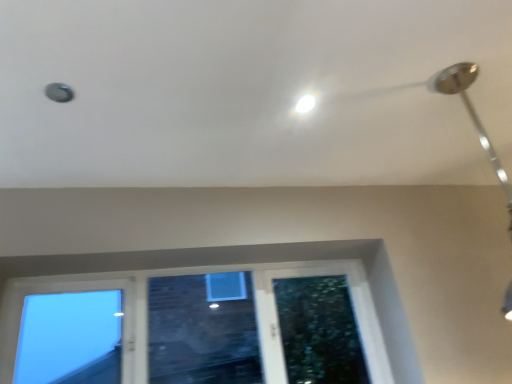
Question: Considering the relative sizes of white glossy droplight at upper center and clear glass window at lower left in the image provided, is white glossy droplight at upper center taller than clear glass window at lower left?

Choices:
 (A) yes
 (B) no

Answer: (B)

Question: Is white glossy droplight at upper center thinner than clear glass window at lower left?

Choices:
 (A) yes
 (B) no

Answer: (A)

Question: From a real-world perspective, is white glossy droplight at upper center located higher than clear glass window at lower left?

Choices:
 (A) no
 (B) yes

Answer: (B)

Question: From the image's perspective, is white glossy droplight at upper center on top of clear glass window at lower left?

Choices:
 (A) no
 (B) yes

Answer: (B)

Question: Is white glossy droplight at upper center directly adjacent to clear glass window at lower left?

Choices:
 (A) yes
 (B) no

Answer: (B)

Question: From the image's perspective, relative to white glossy droplight at upper center, is silver metallic lamp at upper right above or below?

Choices:
 (A) above
 (B) below

Answer: (B)

Question: Does point (465, 99) appear closer or farther from the camera than point (304, 97)?

Choices:
 (A) farther
 (B) closer

Answer: (A)

Question: Is silver metallic lamp at upper right situated inside white glossy droplight at upper center or outside?

Choices:
 (A) inside
 (B) outside

Answer: (B)

Question: Considering the positions of silver metallic lamp at upper right and white glossy droplight at upper center in the image, is silver metallic lamp at upper right taller or shorter than white glossy droplight at upper center?

Choices:
 (A) tall
 (B) short

Answer: (A)

Question: Considering their positions, is white glossy droplight at upper center located in front of or behind silver metallic lamp at upper right?

Choices:
 (A) behind
 (B) front

Answer: (A)

Question: Is white glossy droplight at upper center to the left or to the right of silver metallic lamp at upper right in the image?

Choices:
 (A) right
 (B) left

Answer: (B)

Question: Is white glossy droplight at upper center bigger or smaller than silver metallic lamp at upper right?

Choices:
 (A) small
 (B) big

Answer: (A)

Question: Looking at their shapes, would you say white glossy droplight at upper center is wider or thinner than silver metallic lamp at upper right?

Choices:
 (A) thin
 (B) wide

Answer: (A)

Question: Is silver metallic lamp at upper right to the left or to the right of clear glass window at lower left in the image?

Choices:
 (A) right
 (B) left

Answer: (A)

Question: In terms of height, does silver metallic lamp at upper right look taller or shorter compared to clear glass window at lower left?

Choices:
 (A) short
 (B) tall

Answer: (B)